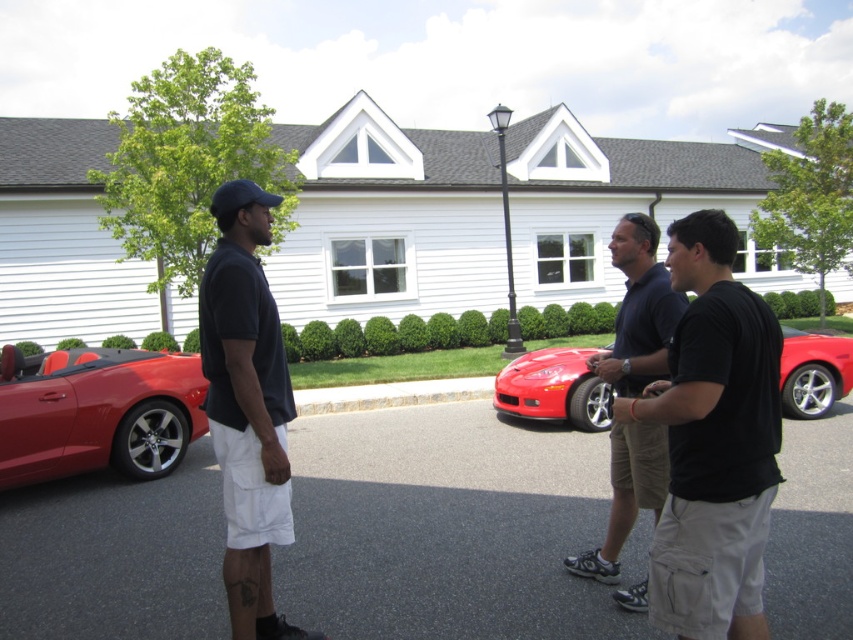
You are standing at the edge of the paved area looking towards the white house. There is asphalt at lower center and a matte black shirt at center in your view. Which object is wider from your perspective?

The asphalt at lower center might be wider than matte black shirt at center.